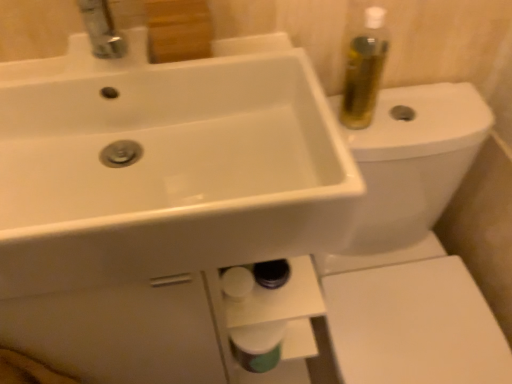
Question: Considering the relative positions of white glossy sink at upper left and white glossy toilet at upper right in the image provided, is white glossy sink at upper left to the right of white glossy toilet at upper right from the viewer's perspective?

Choices:
 (A) no
 (B) yes

Answer: (A)

Question: From the image's perspective, is white glossy sink at upper left on white glossy toilet at upper right?

Choices:
 (A) yes
 (B) no

Answer: (A)

Question: Is white glossy sink at upper left far from white glossy toilet at upper right?

Choices:
 (A) yes
 (B) no

Answer: (B)

Question: Is white glossy sink at upper left looking in the opposite direction of white glossy toilet at upper right?

Choices:
 (A) no
 (B) yes

Answer: (A)

Question: Can you confirm if white glossy sink at upper left is shorter than white glossy toilet at upper right?

Choices:
 (A) yes
 (B) no

Answer: (A)

Question: Is white glossy sink at upper left placed right next to white glossy toilet at upper right?

Choices:
 (A) yes
 (B) no

Answer: (B)

Question: Is white glossy toilet paper at lower center taller than white glossy toilet at upper right?

Choices:
 (A) yes
 (B) no

Answer: (B)

Question: Does white glossy toilet paper at lower center have a lesser height compared to white glossy toilet at upper right?

Choices:
 (A) yes
 (B) no

Answer: (A)

Question: Does white glossy toilet paper at lower center lie in front of white glossy toilet at upper right?

Choices:
 (A) no
 (B) yes

Answer: (A)

Question: Would you consider white glossy toilet paper at lower center to be distant from white glossy toilet at upper right?

Choices:
 (A) yes
 (B) no

Answer: (B)

Question: Considering the relative positions of white glossy toilet paper at lower center and white glossy toilet at upper right in the image provided, is white glossy toilet paper at lower center to the left of white glossy toilet at upper right from the viewer's perspective?

Choices:
 (A) no
 (B) yes

Answer: (B)

Question: From a real-world perspective, is white glossy toilet paper at lower center located beneath white glossy toilet at upper right?

Choices:
 (A) no
 (B) yes

Answer: (A)

Question: From a real-world perspective, is white glossy toilet at upper right positioned under white glossy sink at upper left based on gravity?

Choices:
 (A) yes
 (B) no

Answer: (A)